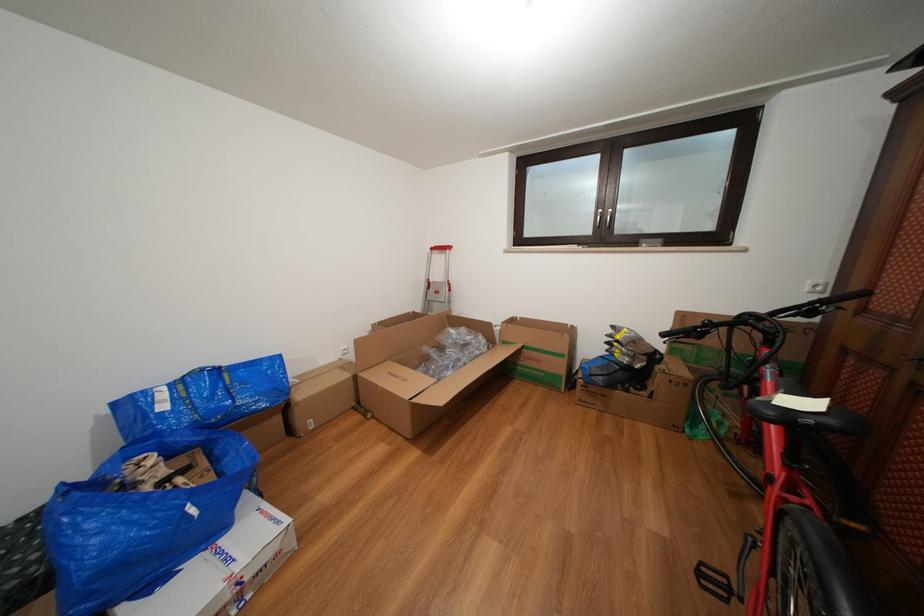
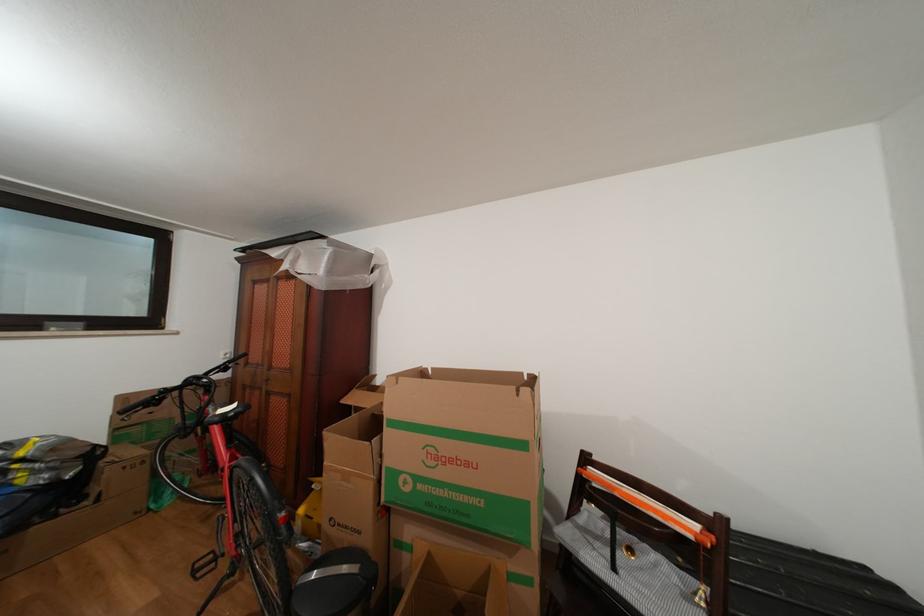
Where in the second image is the point corresponding to point 650,246 from the first image?

(56, 329)